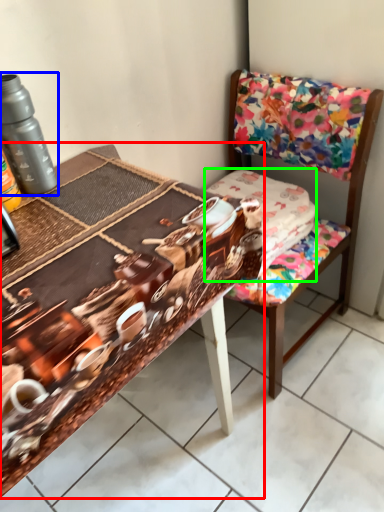
Question: Which object is positioned closest to table (highlighted by a red box)? Select from bottle (highlighted by a blue box) and fabric (highlighted by a green box).

Choices:
 (A) bottle
 (B) fabric

Answer: (A)